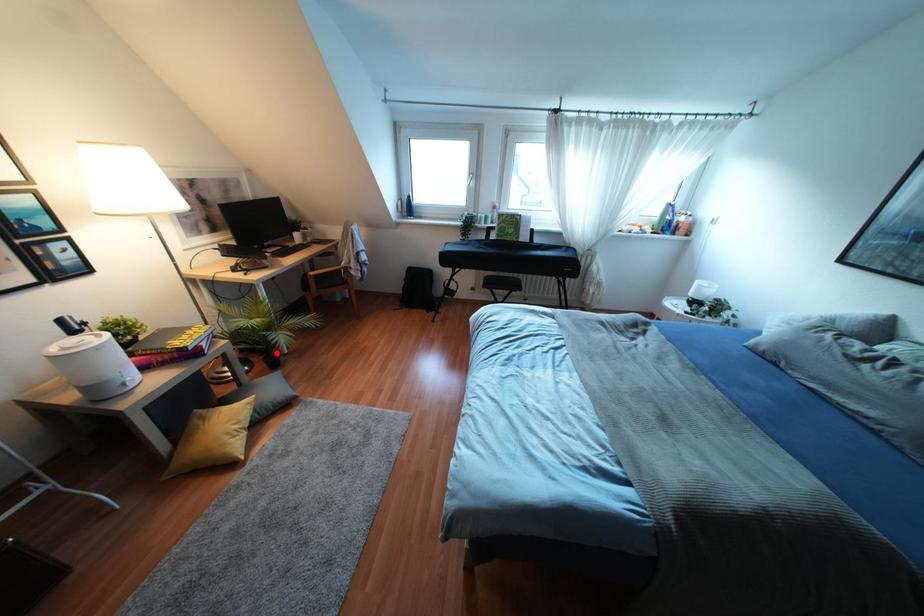
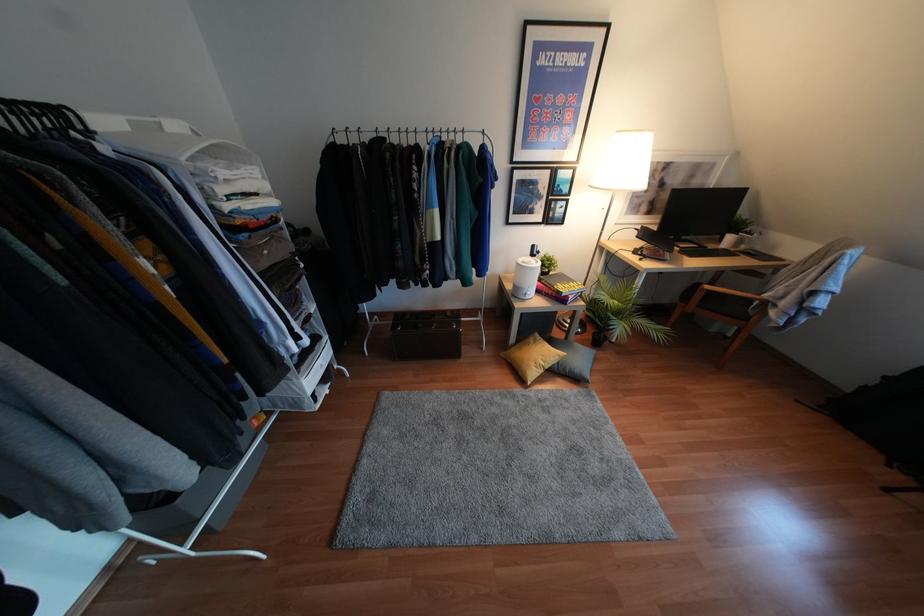
Find the pixel in the second image that matches the highlighted location in the first image.

(604, 336)